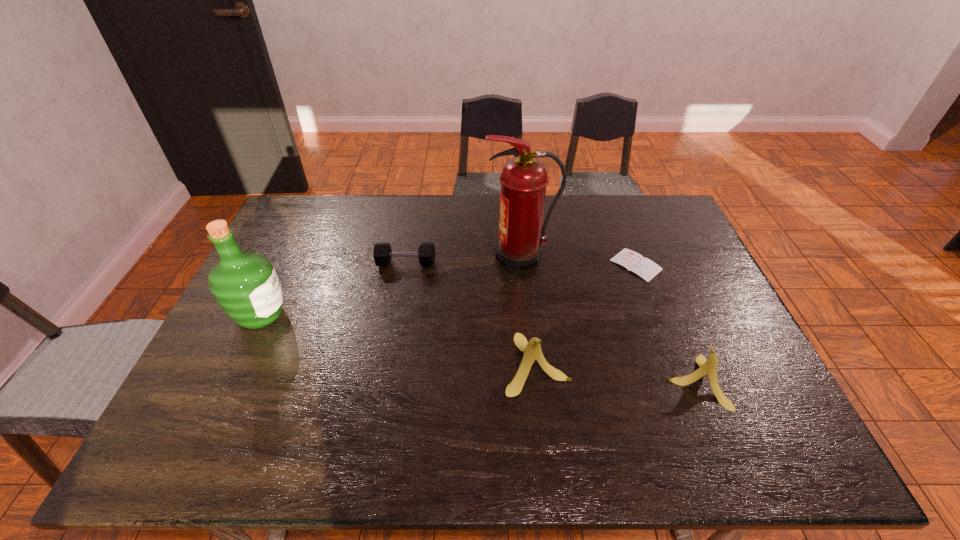
You are a GUI agent. You are given a task and a screenshot of the screen. Output one action in this format:
    pyautogui.click(x=<x>, y=<y>)
    Task: Click on the vacant space that satisfies the following two spatial constraints: 1. on the front-facing side of the fire extinguisher; 2. on the back side of the diary
    
    Given the screenshot: What is the action you would take?
    pyautogui.click(x=521, y=265)

I want to click on vacant point that satisfies the following two spatial constraints: 1. on the front-facing side of the fire extinguisher; 2. on the back side of the shortest object, so click(521, 265).

Where is `free space that satisfies the following two spatial constraints: 1. on the front-facing side of the second tallest object; 2. on the right side of the taller banana`? The height and width of the screenshot is (540, 960). free space that satisfies the following two spatial constraints: 1. on the front-facing side of the second tallest object; 2. on the right side of the taller banana is located at coordinates (239, 363).

You are a GUI agent. You are given a task and a screenshot of the screen. Output one action in this format:
    pyautogui.click(x=<x>, y=<y>)
    Task: Click on the free space in the image that satisfies the following two spatial constraints: 1. on the front-facing side of the left banana; 2. on the right side of the liquor
    
    Given the screenshot: What is the action you would take?
    pyautogui.click(x=239, y=363)

Identify the location of blank area in the image that satisfies the following two spatial constraints: 1. on the front side of the second object from left to right; 2. on the front-facing side of the fifth shortest object. (397, 315).

You are a GUI agent. You are given a task and a screenshot of the screen. Output one action in this format:
    pyautogui.click(x=<x>, y=<y>)
    Task: Click on the free location that satisfies the following two spatial constraints: 1. on the front side of the dumbbell; 2. on the right side of the left banana
    The height and width of the screenshot is (540, 960).
    Given the screenshot: What is the action you would take?
    pyautogui.click(x=389, y=363)

Where is `free point that satisfies the following two spatial constraints: 1. on the front-facing side of the fire extinguisher; 2. on the right side of the right banana`? free point that satisfies the following two spatial constraints: 1. on the front-facing side of the fire extinguisher; 2. on the right side of the right banana is located at coordinates (533, 382).

I want to click on free space in the image that satisfies the following two spatial constraints: 1. on the front-facing side of the fifth shortest object; 2. on the left side of the right banana, so [x=230, y=382].

Locate an element on the screen. vacant point that satisfies the following two spatial constraints: 1. on the back side of the shortest object; 2. on the left side of the taller banana is located at coordinates (525, 265).